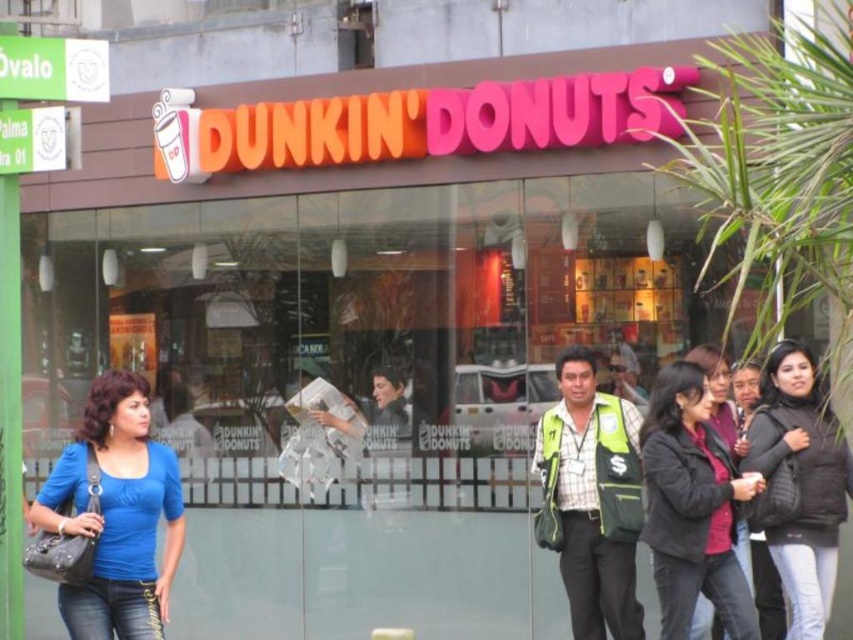
You are standing in front of the Dunkin Donuts store. There is a point at coordinates point (x=131, y=484). Can you estimate how far this point is from you in meters?

The point (x=131, y=484) is 5.46 meters away from you.

You are standing in front of the Dunkin Donuts store and want to find the dark brown leather jacket at center. Where exactly is it located?

The dark brown leather jacket at center is located at point [692,508].

You are standing in front of the Dunkin Donuts store and want to reach the point marked at coordinates point [364,580]. Can you estimate how far you need to walk to get there?

The distance between you and the point [364,580] is 7.95 meters, so you need to walk approximately 7.95 meters to reach it.